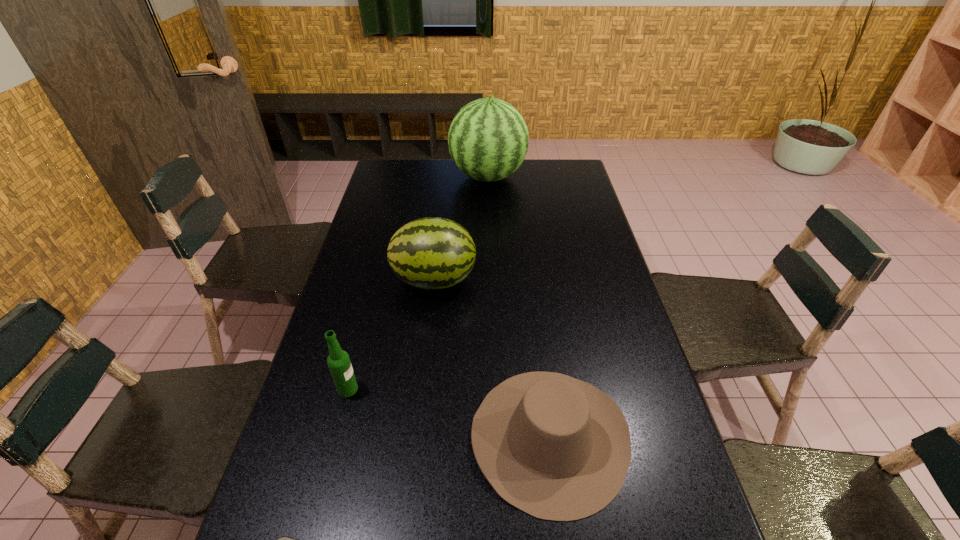
At what (x,y) coordinates should I click in order to perform the action: click on vacant space that satisfies the following two spatial constraints: 1. on the front side of the tallest object; 2. on the right side of the fourth tallest object. Please return your answer as a coordinate pair (x, y). The width and height of the screenshot is (960, 540). Looking at the image, I should click on (494, 437).

Image resolution: width=960 pixels, height=540 pixels. What are the coordinates of `free region that satisfies the following two spatial constraints: 1. on the front side of the tallest object; 2. on the left side of the cowboy hat` in the screenshot? It's located at (494, 437).